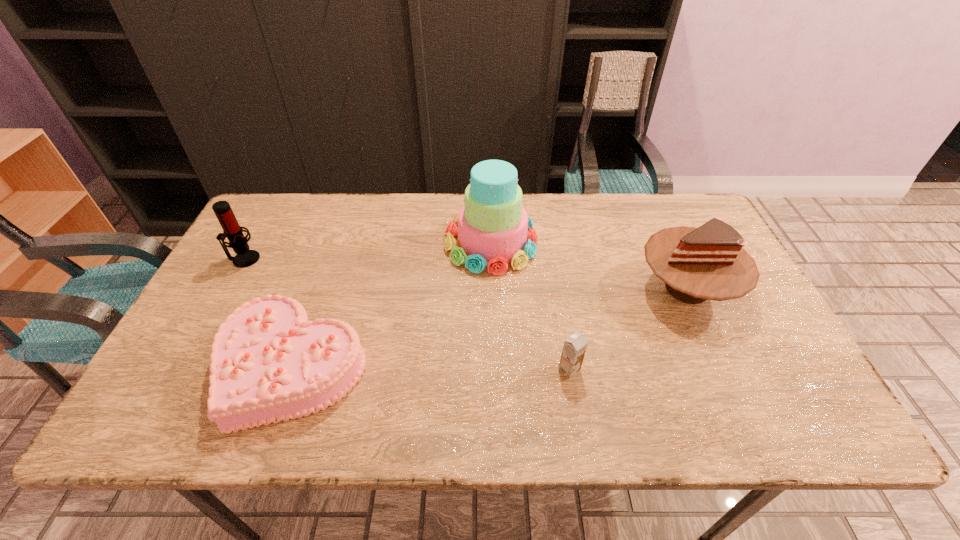
Identify the location of the third object from right to left. (492, 231).

Identify the location of the second cake from right to left. (492, 231).

The image size is (960, 540). I want to click on the leftmost object, so click(x=231, y=229).

The width and height of the screenshot is (960, 540). What are the coordinates of `the rightmost object` in the screenshot? It's located at (709, 262).

Locate an element on the screen. the second shortest cake is located at coordinates (709, 262).

At what (x,y) coordinates should I click in order to perform the action: click on chocolate milk. Please return your answer as a coordinate pair (x, y). Looking at the image, I should click on (574, 348).

In order to click on the fourth tallest object in this screenshot , I will do `click(574, 348)`.

Where is `the shortest cake`? This screenshot has width=960, height=540. the shortest cake is located at coordinates (269, 363).

Locate an element on the screen. the leftmost cake is located at coordinates (269, 363).

The image size is (960, 540). I want to click on free point located 0.400m on the right of the tallest cake, so click(670, 242).